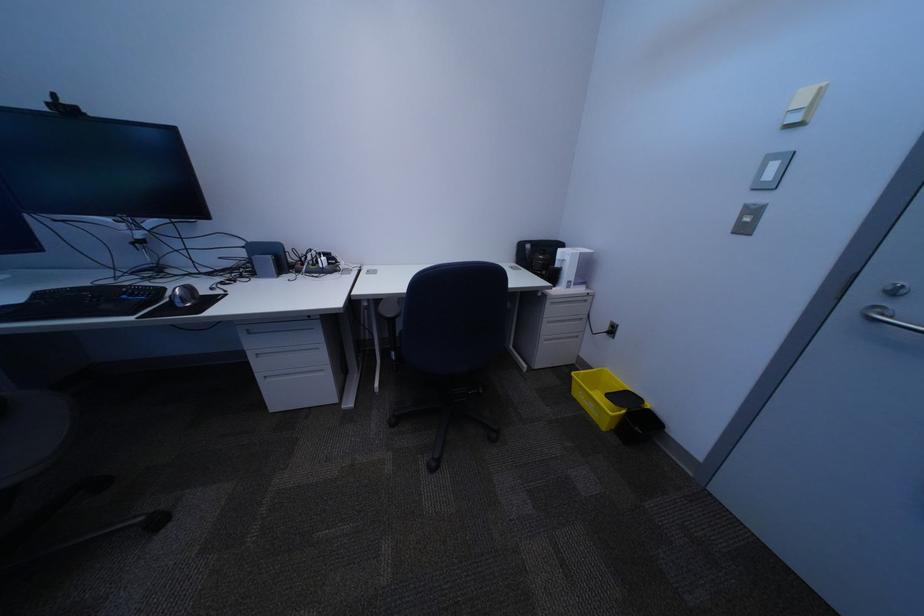
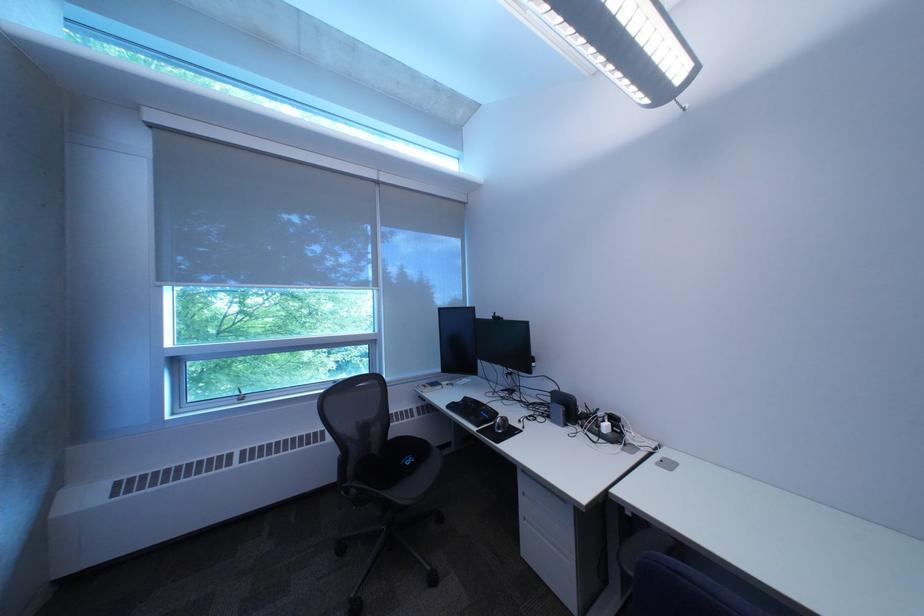
Find the pixel in the second image that matches (x=191, y=253) in the first image.

(532, 387)